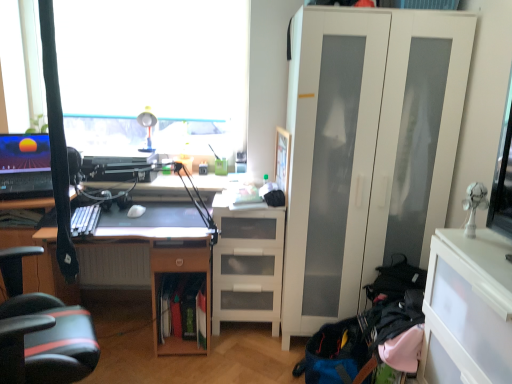
Describe the element at coordinates (367, 149) in the screenshot. I see `white matte cabinet at right` at that location.

Find the location of `transparent glass window at upper left`. transparent glass window at upper left is located at coordinates (153, 69).

Measure the distance between point (x=251, y=304) and camera.

Point (x=251, y=304) and camera are 8.16 feet apart.

You are a GUI agent. You are given a task and a screenshot of the screen. Output one action in this format:
    pyautogui.click(x=<x>, y=<y>)
    Task: Click on the white matte mouse at center
    The image size is (512, 384).
    Given the screenshot: What is the action you would take?
    pyautogui.click(x=136, y=211)

Find the location of a particular element. white matte cabinet at right is located at coordinates (367, 149).

From a real-world perspective, which is physically above, white matte cabinet at right or white matte drawer at center?

From a 3D spatial view, white matte cabinet at right is above.

Who is bigger, white matte cabinet at right or white matte drawer at center?

white matte cabinet at right is bigger.

Which is in front, point (438, 201) or point (238, 267)?

The point (438, 201) is in front.

Based on the photo, in terms of height, does white matte cabinet at right look taller or shorter compared to white matte drawer at center?

white matte cabinet at right is taller than white matte drawer at center.

Is matte plastic table lamp at upper center to the left of white matte mouse at center from the viewer's perspective?

Yes.

Do you think matte plastic table lamp at upper center is within white matte mouse at center, or outside of it?

matte plastic table lamp at upper center exists outside the volume of white matte mouse at center.

From the image's perspective, is matte plastic table lamp at upper center above or below white matte mouse at center?

Clearly, from the image's perspective, matte plastic table lamp at upper center is above white matte mouse at center.

From a real-world perspective, does matte plastic table lamp at upper center stand above white matte mouse at center?

Correct, in the physical world, matte plastic table lamp at upper center is higher than white matte mouse at center.

Is transparent plastic cabinet at lower right touching white matte mouse at center?

No, transparent plastic cabinet at lower right is not with white matte mouse at center.

I want to click on cabinetry on the right of white matte mouse at center, so click(463, 320).

What's the angular difference between transparent plastic cabinet at lower right and white matte mouse at center's facing directions?

transparent plastic cabinet at lower right and white matte mouse at center are facing 87.1 degrees away from each other.

Is white matte mouse at center at the back of transparent plastic cabinet at lower right?

That's not correct — transparent plastic cabinet at lower right is not looking away from white matte mouse at center.

Considering the relative sizes of transparent plastic cabinet at lower right and matte plastic table lamp at upper center in the image provided, is transparent plastic cabinet at lower right shorter than matte plastic table lamp at upper center?

In fact, transparent plastic cabinet at lower right may be taller than matte plastic table lamp at upper center.

Does transparent plastic cabinet at lower right appear on the right side of matte plastic table lamp at upper center?

Yes.

Is transparent plastic cabinet at lower right not close to matte plastic table lamp at upper center?

Indeed, transparent plastic cabinet at lower right is not near matte plastic table lamp at upper center.

From the image's perspective, is wooden desk at center above white matte drawer at center?

No.

Which object is thinner, wooden desk at center or white matte drawer at center?

Thinner between the two is white matte drawer at center.

Can you tell me how much wooden desk at center and white matte drawer at center differ in facing direction?

The angle between the facing direction of wooden desk at center and the facing direction of white matte drawer at center is 3.99 degrees.

Would you say wooden desk at center is outside white matte drawer at center?

Indeed, wooden desk at center is completely outside white matte drawer at center.

Which is further, (138,207) or (500,356)?

Point (138,207)

Is white matte mouse at center turned away from transparent plastic cabinet at lower right?

No.

Looking at this image, is transparent plastic cabinet at lower right a part of white matte mouse at center?

No, white matte mouse at center does not contain transparent plastic cabinet at lower right.

Which is farther from the camera, (319, 113) or (479, 335)?

Point (319, 113)

Considering the sizes of objects white matte cabinet at right and transparent plastic cabinet at lower right in the image provided, who is bigger, white matte cabinet at right or transparent plastic cabinet at lower right?

Bigger between the two is white matte cabinet at right.

Are white matte cabinet at right and transparent plastic cabinet at lower right far apart?

No, white matte cabinet at right is in close proximity to transparent plastic cabinet at lower right.

Locate an element on the screen. The width and height of the screenshot is (512, 384). shelf located below the white matte cabinet at right (from the image's perspective) is located at coordinates (247, 265).

Locate an element on the screen. The image size is (512, 384). mouse located on the right of matte plastic table lamp at upper center is located at coordinates (136, 211).

Based on their spatial positions, is transparent glass window at upper left or transparent plastic cabinet at lower right further from matte plastic table lamp at upper center?

Result: The object further to matte plastic table lamp at upper center is transparent plastic cabinet at lower right.

When comparing their distances from matte plastic table lamp at upper center, does white matte cabinet at right or white matte mouse at center seem further?

white matte cabinet at right lies further to matte plastic table lamp at upper center than the other object.

When comparing their distances from matte plastic table lamp at upper center, does wooden desk at center or white matte cabinet at right seem closer?

The object closer to matte plastic table lamp at upper center is wooden desk at center.

Considering their positions, is white matte drawer at center positioned further to white matte cabinet at right than white matte mouse at center?

Based on the image, white matte mouse at center appears to be further to white matte cabinet at right.

Considering their positions, is white matte drawer at center positioned closer to matte plastic table lamp at upper center than transparent plastic cabinet at lower right?

The object closer to matte plastic table lamp at upper center is white matte drawer at center.

Looking at the image, which one is located closer to white matte mouse at center, white matte drawer at center or transparent glass window at upper left?

white matte drawer at center.

Looking at the image, which one is located further to wooden desk at center, matte plastic table lamp at upper center or white matte cabinet at right?

white matte cabinet at right is further to wooden desk at center.

Considering their positions, is transparent glass window at upper left positioned further to white matte cabinet at right than white matte drawer at center?

transparent glass window at upper left is further to white matte cabinet at right.

Locate an element on the screen. The image size is (512, 384). table lamp situated between transparent glass window at upper left and white matte cabinet at right from left to right is located at coordinates (147, 127).

At what (x,y) coordinates should I click in order to perform the action: click on dresser situated between wooden desk at center and transparent plastic cabinet at lower right from left to right. Please return your answer as a coordinate pair (x, y). This screenshot has width=512, height=384. Looking at the image, I should click on (367, 149).

This screenshot has height=384, width=512. What are the coordinates of `shelf that lies between transparent glass window at upper left and transparent plastic cabinet at lower right from top to bottom` in the screenshot? It's located at (247, 265).

I want to click on table lamp between wooden desk at center and white matte cabinet at right in the horizontal direction, so click(x=147, y=127).